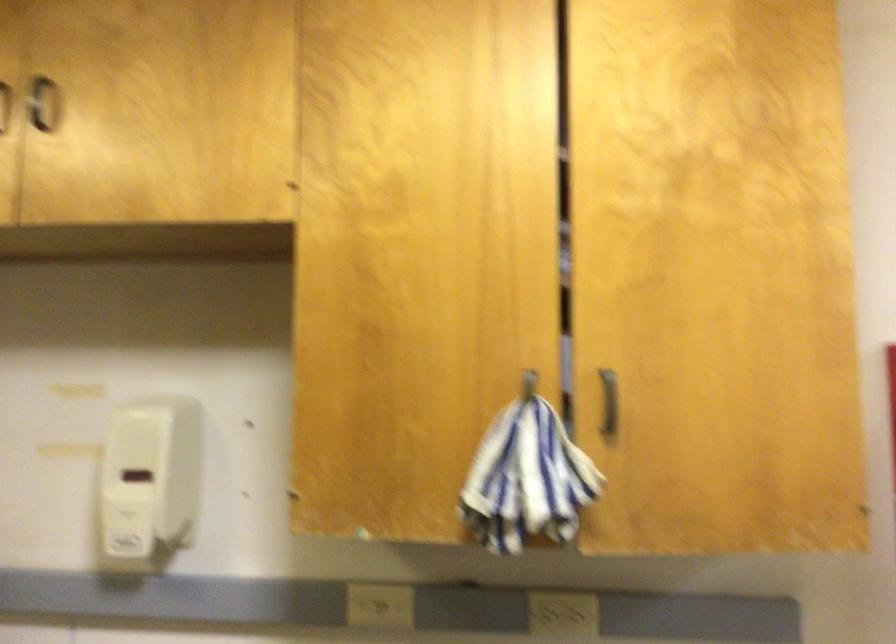
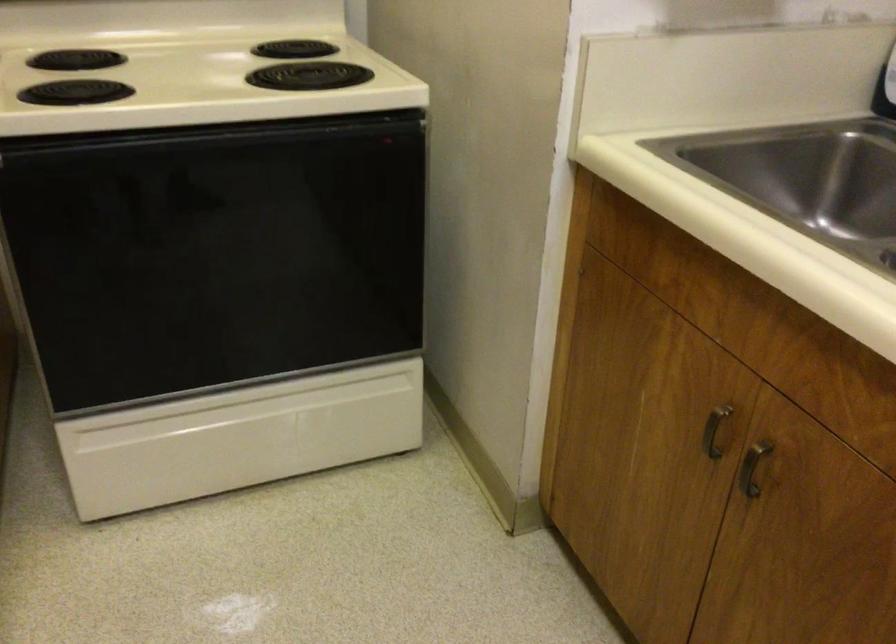
The images are taken continuously from a first-person perspective. In which direction is your viewpoint rotating?

The rotation direction of the camera is left-down.